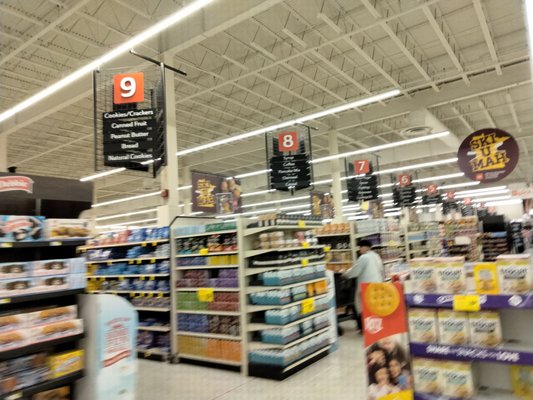
The image size is (533, 400). Find the location of `advertising display from ceiling`. advertising display from ceiling is located at coordinates (205, 180), (231, 184).